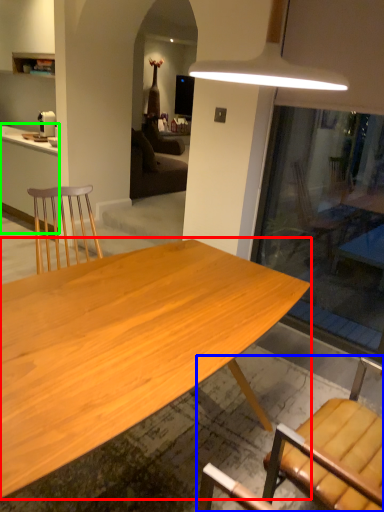
Question: Considering the real-world distances, which object is closest to desk (highlighted by a red box)? chair (highlighted by a blue box) or cabinetry (highlighted by a green box).

Choices:
 (A) chair
 (B) cabinetry

Answer: (A)